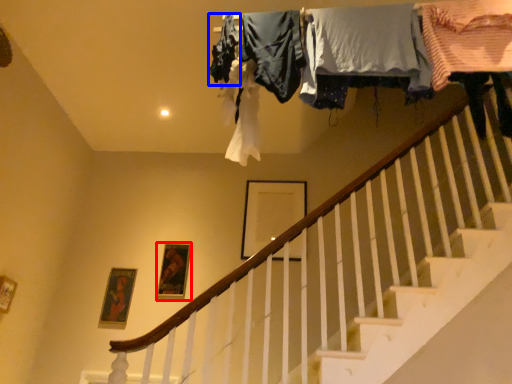
Question: Which of the following is the farthest to the observer, picture frame (highlighted by a red box) or clothing (highlighted by a blue box)?

Choices:
 (A) picture frame
 (B) clothing

Answer: (A)